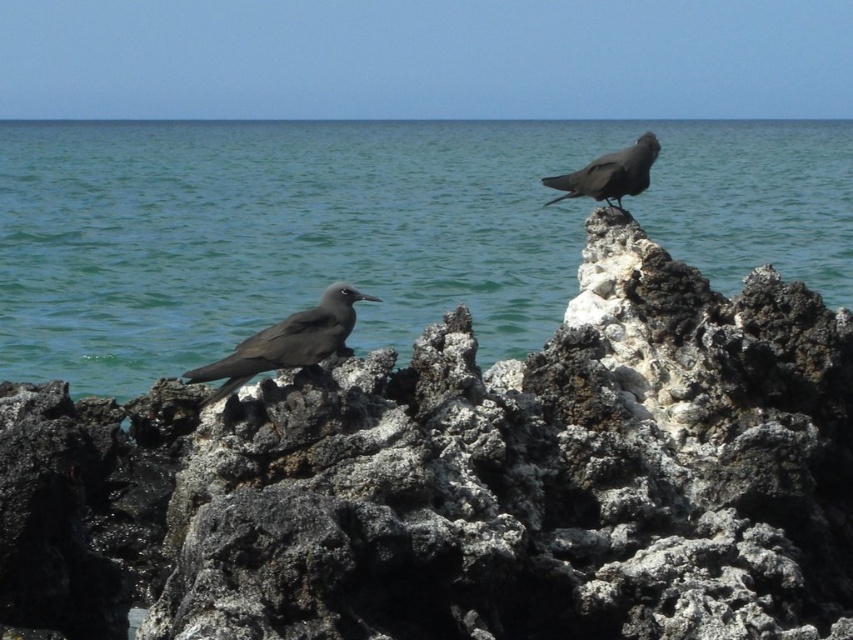
You are a photographer standing on the volcanic rocks in the foreground. You want to capture a photo that includes both the blue water at center and the matte black bird at upper right. Based on their positions, which object should you adjust your camera to focus on first to ensure both are in the frame?

The blue water at center is above the matte black bird at upper right, so you should focus on the blue water at center first to ensure both are in the frame.

You are a photographer trying to capture the matte black bird at lower left and the rough textured rock at center in the same frame. Based on their positions, which object should you adjust your camera to focus on first if you want to include both in your shot?

The matte black bird at lower left is to the left of the rough textured rock at center, so you should focus on the matte black bird at lower left first to ensure both are in the frame.